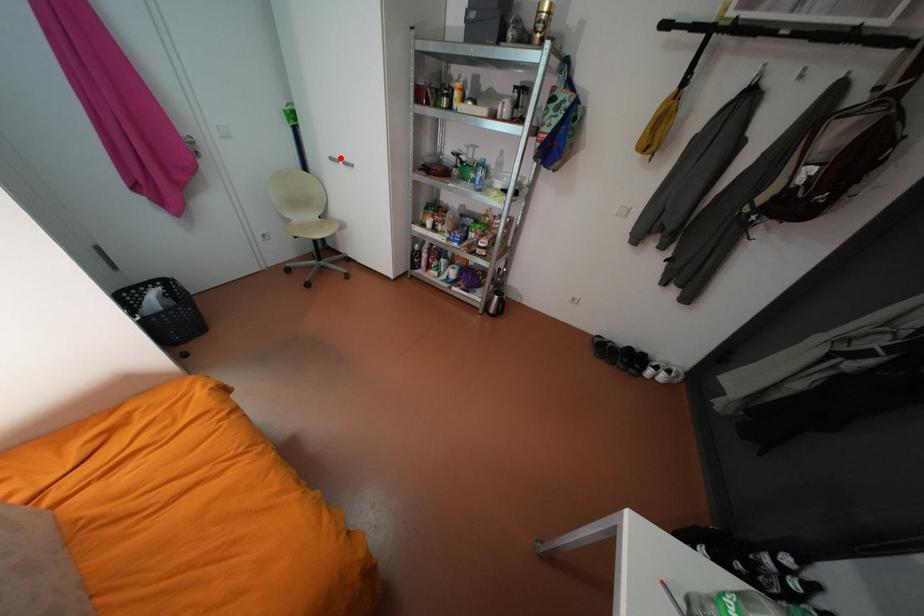
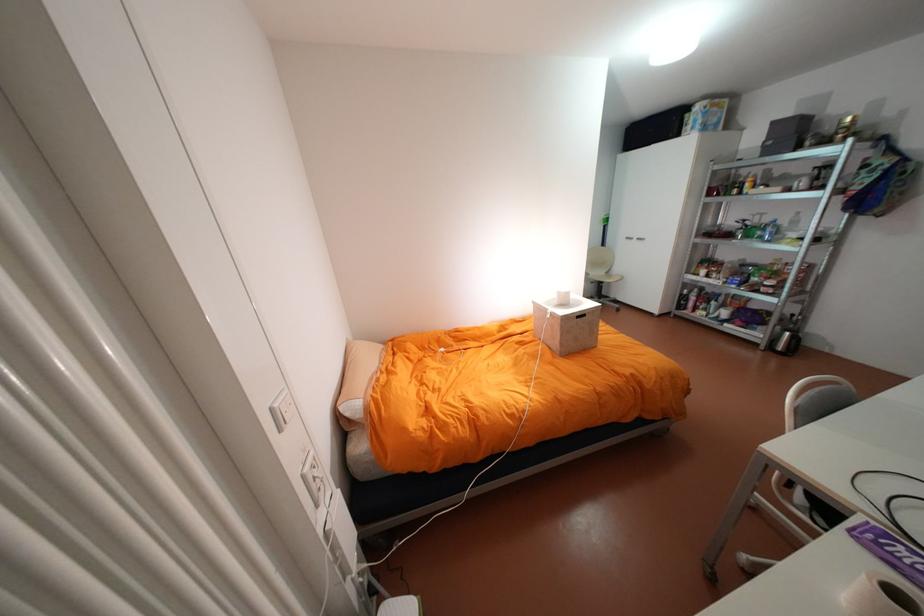
Question: A red point is marked in image1. In image2, is the corresponding 3D point closer to the camera or farther? Reply with the corresponding letter.

Choices:
 (A) The corresponding 3D point is closer.
 (B) The corresponding 3D point is farther.

Answer: (A)